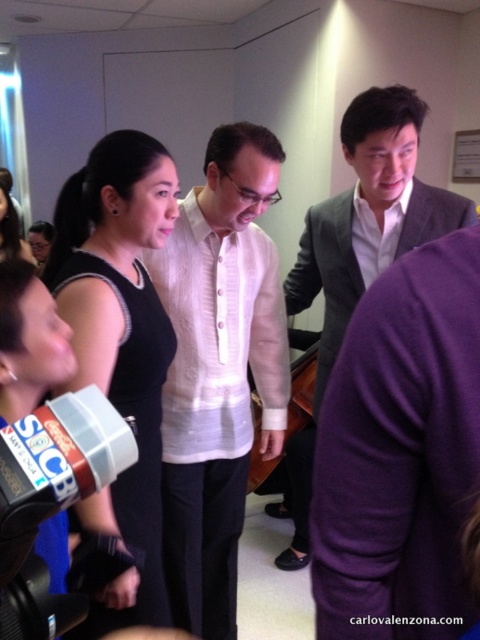
Who is more forward, (231, 234) or (46, 596)?

Positioned in front is point (46, 596).

Is point (172, 396) positioned after point (25, 460)?

Yes, point (172, 396) is farther from viewer.

Is point (168, 452) farther from camera compared to point (72, 406)?

That is True.

Identify the location of white linen shirt at center. The height and width of the screenshot is (640, 480). tap(218, 369).

Between black matte dress at center and gray wool suit at center, which one is positioned lower?

black matte dress at center is below.

Which is behind, point (169, 616) or point (395, 184)?

The point (395, 184) is behind.

Locate an element on the screen. This screenshot has height=640, width=480. black matte dress at center is located at coordinates pos(120,346).

What are the coordinates of `black matte dress at center` in the screenshot? It's located at pyautogui.click(x=120, y=346).

Does gray wool suit at center appear over black plastic video camera at lower left?

Yes.

This screenshot has height=640, width=480. What do you see at coordinates (359, 256) in the screenshot?
I see `gray wool suit at center` at bounding box center [359, 256].

Find the location of `gray wool suit at center`. gray wool suit at center is located at coordinates (359, 256).